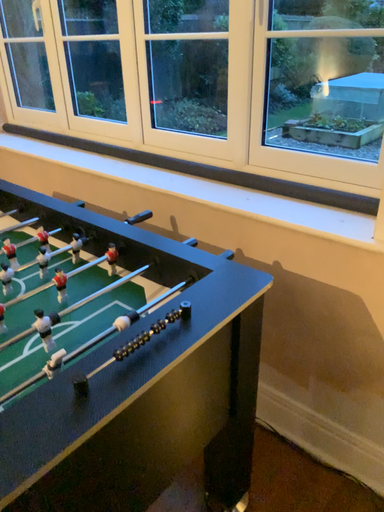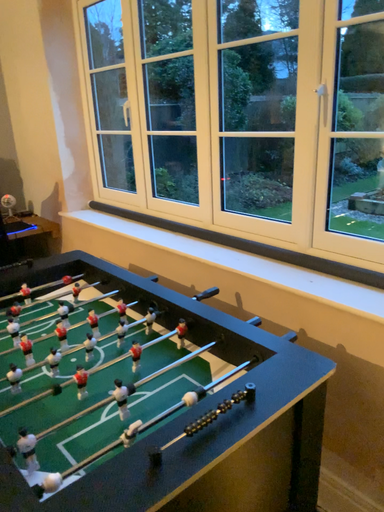
Question: Which way did the camera rotate in the video?

Choices:
 (A) rotated right
 (B) rotated left

Answer: (B)